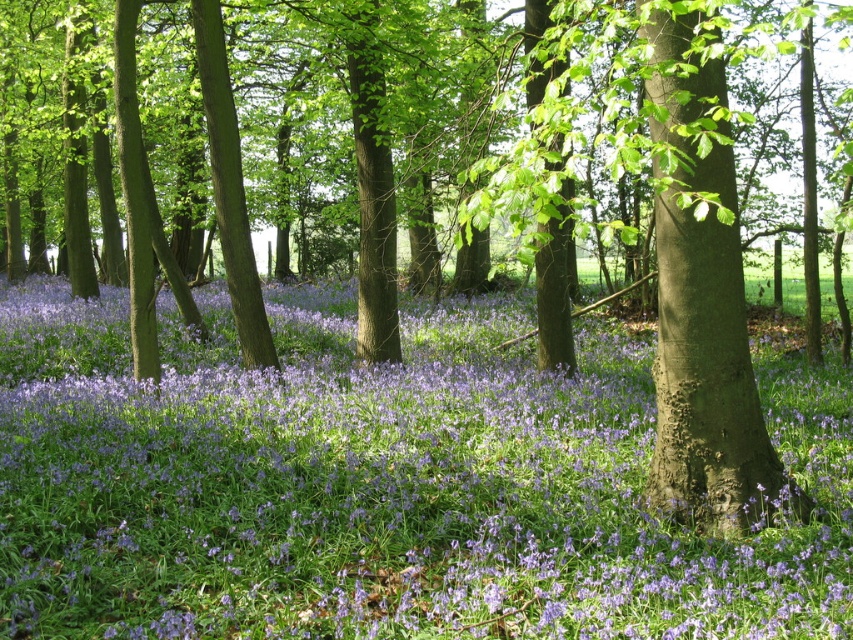
Question: Does purple matte flower at center have a lesser width compared to smooth brown tree trunk at center?

Choices:
 (A) yes
 (B) no

Answer: (B)

Question: Which point appears closest to the camera in this image?

Choices:
 (A) (666, 54)
 (B) (393, 538)

Answer: (A)

Question: Is purple matte flower at center bigger than smooth brown tree trunk at center?

Choices:
 (A) no
 (B) yes

Answer: (B)

Question: Which of the following is the farthest from the observer?

Choices:
 (A) smooth brown tree trunk at center
 (B) purple matte flower at center

Answer: (B)

Question: Is purple matte flower at center above smooth brown tree trunk at center?

Choices:
 (A) yes
 (B) no

Answer: (B)